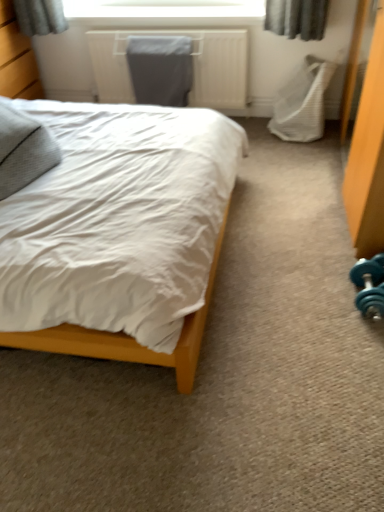
Question: From the image's perspective, is wooden dresser at left above or below teal rubber dumbbell at lower right?

Choices:
 (A) above
 (B) below

Answer: (A)

Question: Is point (31, 74) positioned closer to the camera than point (375, 286)?

Choices:
 (A) closer
 (B) farther

Answer: (B)

Question: Which object is the farthest from the wooden dresser at left?

Choices:
 (A) gray fabric pillow at left
 (B) white fabric swivel chair at right
 (C) white matte bed at center
 (D) teal rubber dumbbell at lower right

Answer: (D)

Question: Estimate the real-world distances between objects in this image. Which object is farther from the white fabric swivel chair at right?

Choices:
 (A) teal rubber dumbbell at lower right
 (B) wooden dresser at left
 (C) white matte bed at center
 (D) gray fabric pillow at left

Answer: (B)